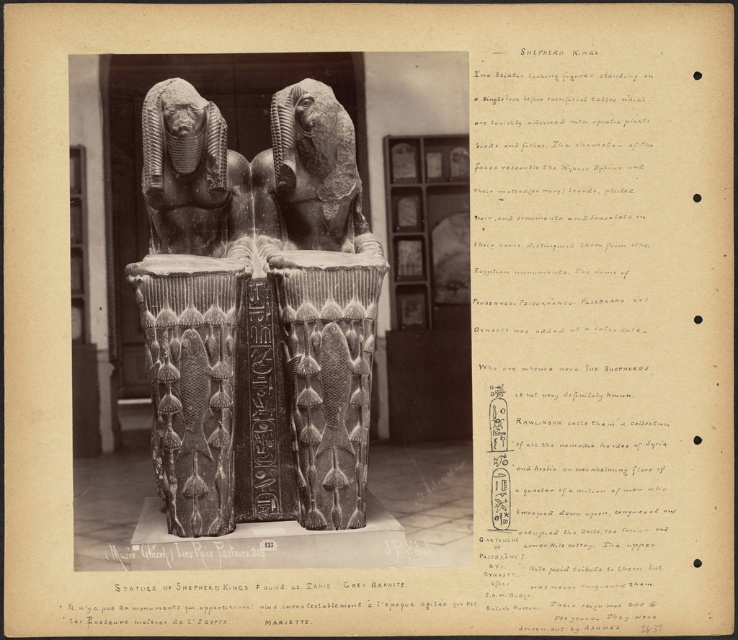
Between point (227, 282) and point (325, 188), which one is positioned in front?

Point (227, 282)

Find the location of a particular element. This screenshot has height=640, width=738. gray granite sphinxes at center is located at coordinates (255, 312).

Is point (351, 492) positioned before point (303, 182)?

Yes, point (351, 492) is in front of point (303, 182).

You are a GUI agent. You are given a task and a screenshot of the screen. Output one action in this format:
    pyautogui.click(x=<x>, y=<y>)
    Task: Click on the gray granite sphinxes at center
    
    Given the screenshot: What is the action you would take?
    pyautogui.click(x=255, y=312)

Between gray granite sphinxes at center and dark gray stone sphinx at center, which one appears on the right side from the viewer's perspective?

From the viewer's perspective, gray granite sphinxes at center appears more on the right side.

Does gray granite sphinxes at center have a lesser width compared to dark gray stone sphinx at center?

No, gray granite sphinxes at center is not thinner than dark gray stone sphinx at center.

Who is more distant from viewer, (339,481) or (190,228)?

The point (190,228) is behind.

Locate an element on the screen. The image size is (738, 640). gray granite sphinxes at center is located at coordinates (255, 312).

Does dark gray stone sphinx at center have a lesser width compared to gray granite statue at center?

Correct, dark gray stone sphinx at center's width is less than gray granite statue at center's.

Who is positioned more to the left, dark gray stone sphinx at center or gray granite statue at center?

dark gray stone sphinx at center

Is point (162, 100) closer to viewer compared to point (337, 132)?

Yes.

At what (x,y) coordinates should I click in order to perform the action: click on dark gray stone sphinx at center. Please return your answer as a coordinate pair (x, y). Looking at the image, I should click on (190, 173).